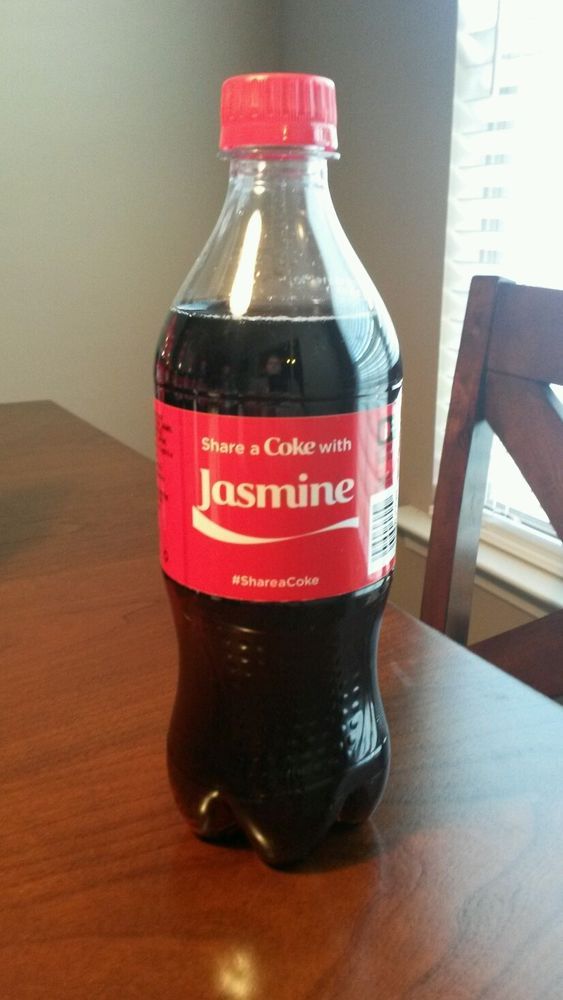
The width and height of the screenshot is (563, 1000). I want to click on wall, so click(x=106, y=216).